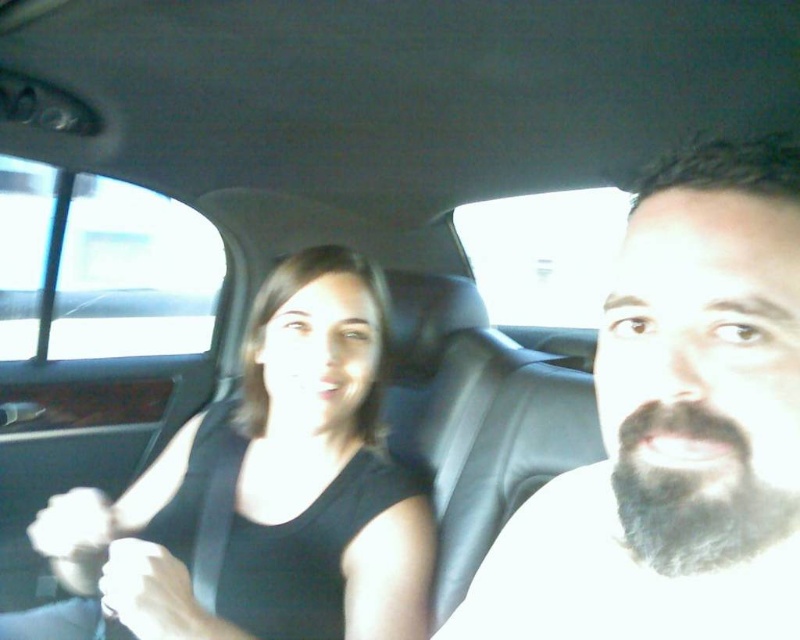
Which is below, dark brown beard at right or black fabric shirt at upper left?

Positioned lower is black fabric shirt at upper left.

Can you confirm if dark brown beard at right is positioned above black fabric shirt at upper left?

Yes.

Does point (788, 429) come closer to viewer compared to point (254, 352)?

Yes, it is.

The image size is (800, 640). In order to click on dark brown beard at right in this screenshot , I will do `click(676, 429)`.

The image size is (800, 640). Describe the element at coordinates (281, 484) in the screenshot. I see `black fabric shirt at upper left` at that location.

Is point (244, 500) farther from viewer compared to point (92, 506)?

Yes, point (244, 500) is farther from viewer.

From the picture: Who is more distant from viewer, (x=396, y=536) or (x=72, y=490)?

The point (x=72, y=490) is behind.

Locate an element on the screen. Image resolution: width=800 pixels, height=640 pixels. black fabric shirt at upper left is located at coordinates (281, 484).

Looking at this image, is dark brown beard at right behind matte black hand at center?

No, it is not.

Is dark brown beard at right shorter than matte black hand at center?

No.

Who is more forward, (632,356) or (146,600)?

Point (632,356) is in front.

Locate an element on the screen. Image resolution: width=800 pixels, height=640 pixels. dark brown beard at right is located at coordinates (676, 429).